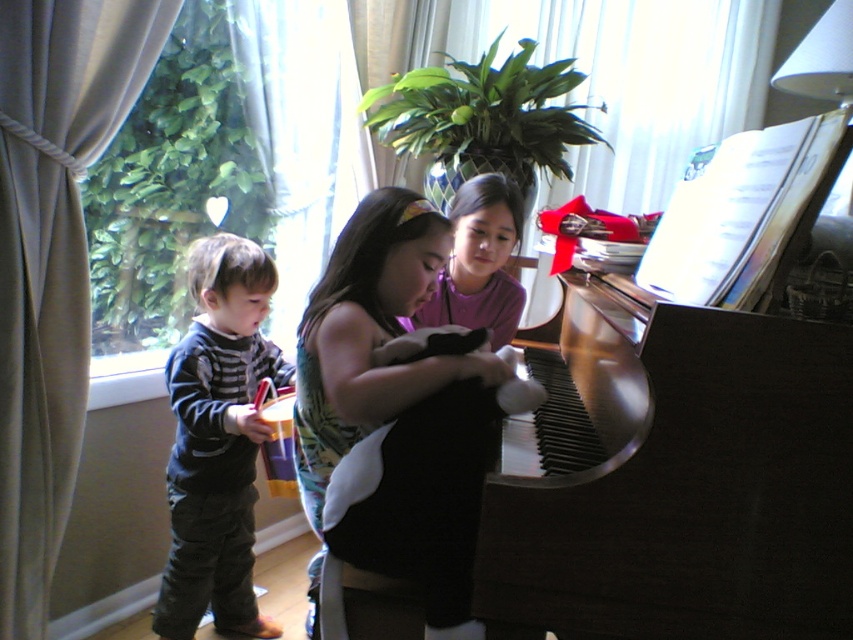
You are organizing a clothing donation drive and need to determine which item takes up more space in the donation box. Which item between the black fabric dress at center and the matte purple shirt at center is wider?

The matte purple shirt at center is wider than the black fabric dress at center, so it takes up more space in the donation box.

You are a parent trying to dress your child for a cold day. You have two options in the image, the dark blue striped sweater at left and the black fabric dress at center. Which one would be warmer based on their sizes?

The dark blue striped sweater at left is larger in size than the black fabric dress at center, so it would provide more warmth and coverage, making it the better choice for a cold day.